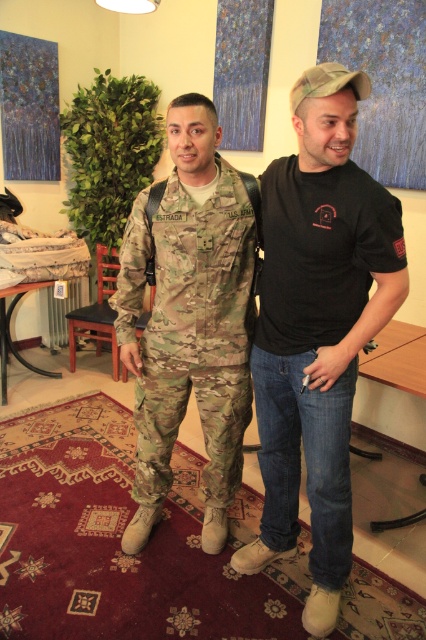
Does point (278, 392) lie in front of point (210, 314)?

Yes, point (278, 392) is closer to viewer.

Does black matte t-shirt at center have a smaller size compared to camouflage fabric uniform at center?

Actually, black matte t-shirt at center might be larger than camouflage fabric uniform at center.

Between point (337, 572) and point (216, 444), which one is positioned behind?

The point (216, 444) is behind.

At what (x,y) coordinates should I click in order to perform the action: click on black matte t-shirt at center. Please return your answer as a coordinate pair (x, y). This screenshot has height=640, width=426. Looking at the image, I should click on 317,326.